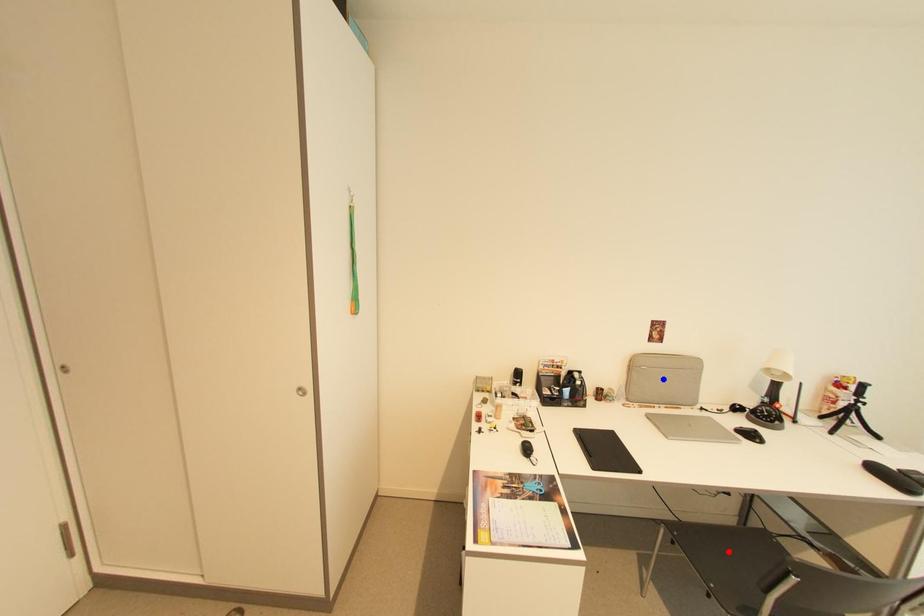
Question: Which of the two points in the image is closer to the camera?

Choices:
 (A) Blue point is closer.
 (B) Red point is closer.

Answer: (B)